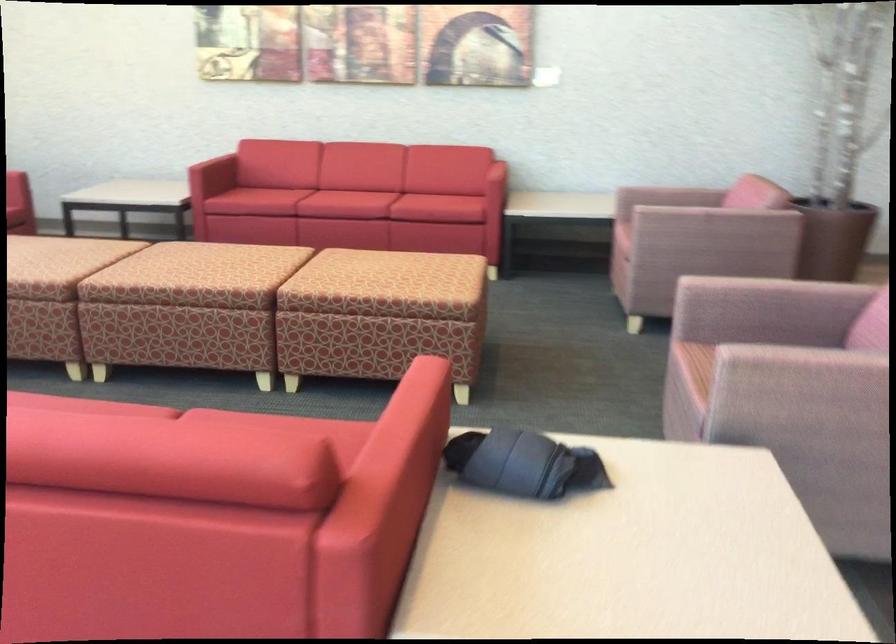
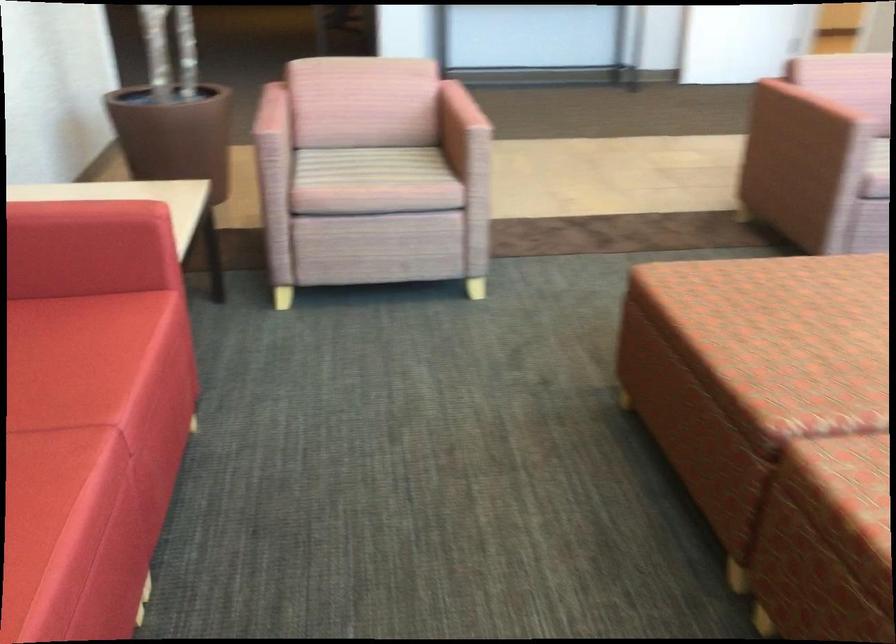
In the second image, find the point that corresponds to point 433,183 in the first image.

(69, 360)